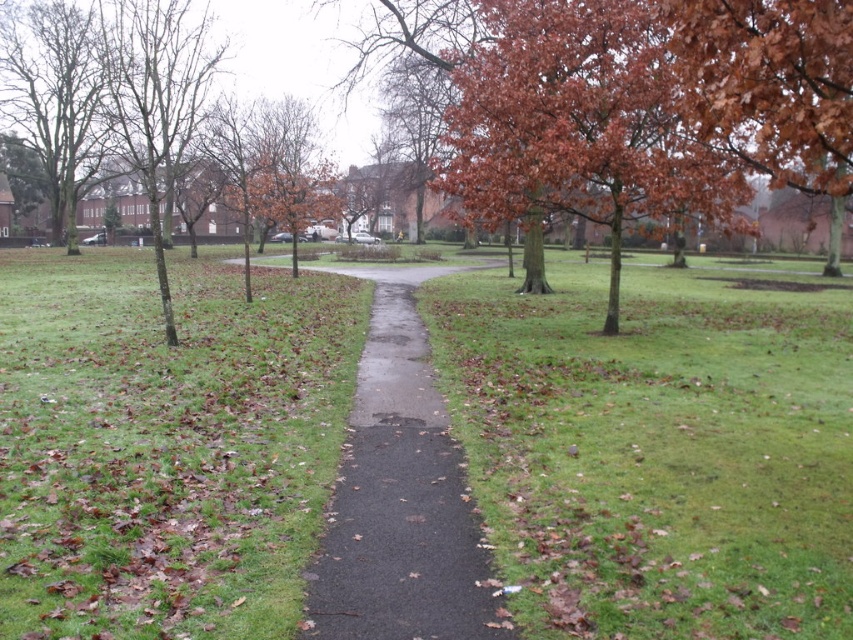
Who is more distant from viewer, (335, 324) or (688, 33)?

The point (335, 324) is more distant.

You are a GUI agent. You are given a task and a screenshot of the screen. Output one action in this format:
    pyautogui.click(x=<x>, y=<y>)
    Task: Click on the green grass at center
    This screenshot has width=853, height=640.
    Given the screenshot: What is the action you would take?
    pyautogui.click(x=165, y=442)

Can you confirm if brown leafy tree at upper center is smaller than black asphalt path at center?

Actually, brown leafy tree at upper center might be larger than black asphalt path at center.

Which is in front, point (669, 36) or point (379, 474)?

Point (379, 474) is in front.

Identify the location of brown leafy tree at upper center. Image resolution: width=853 pixels, height=640 pixels. (659, 68).

This screenshot has height=640, width=853. Find the location of `green grassy at center`. green grassy at center is located at coordinates (656, 451).

Who is lower down, green grassy at center or green grass at center?

green grassy at center is lower down.

The width and height of the screenshot is (853, 640). What do you see at coordinates (656, 451) in the screenshot?
I see `green grassy at center` at bounding box center [656, 451].

At what (x,y) coordinates should I click in order to perform the action: click on green grassy at center. Please return your answer as a coordinate pair (x, y). This screenshot has width=853, height=640. Looking at the image, I should click on (656, 451).